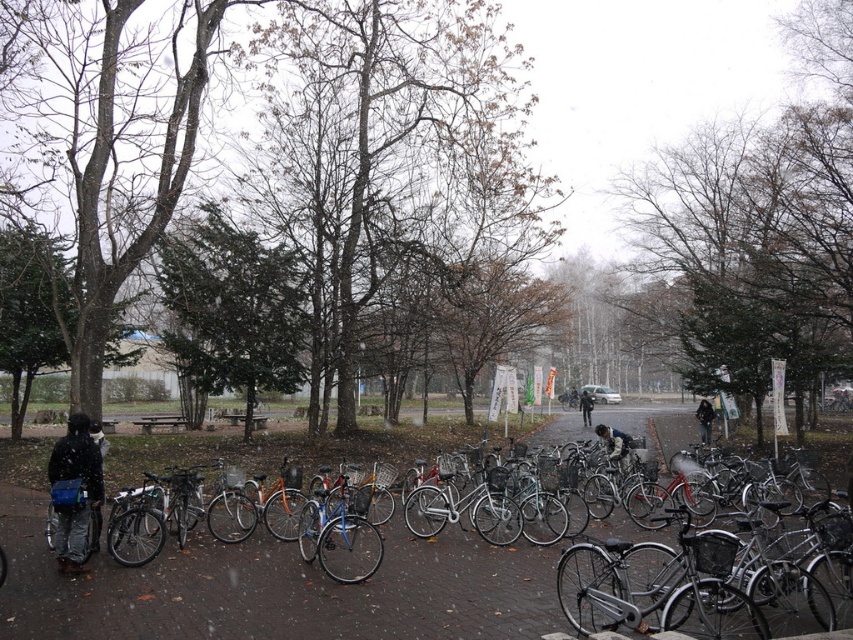
You are standing in the park and want to walk from point A to point B. Point A is at coordinates point [653,557] and point B is at coordinates point [59,474]. Given that the path between them is covered in snow, which direction should you head to move from point A to point B?

Since point [653,557] is further to the viewer than point [59,474], you should move towards the lower right direction to go from point A to point B.

You are standing at the entrance of the park and see the shiny black bicycle at lower right and the matte black jacket at left. If you want to reach both items, which one would you need to walk further to get to?

The shiny black bicycle at lower right and the matte black jacket at left are 5.59 meters apart from each other. Therefore, to reach both items, you would need to walk further to the one that is farther away. However, since the exact distance from your current position isn

You are a photographer wanting to capture both the shiny black bicycle at lower right and the dark blue jacket at center in a single frame. Which object should you focus on first if you want to ensure both are in focus without moving the camera?

You should focus on the dark blue jacket at center first because it is larger than the shiny black bicycle at lower right, allowing for a greater depth of field to include both in focus.